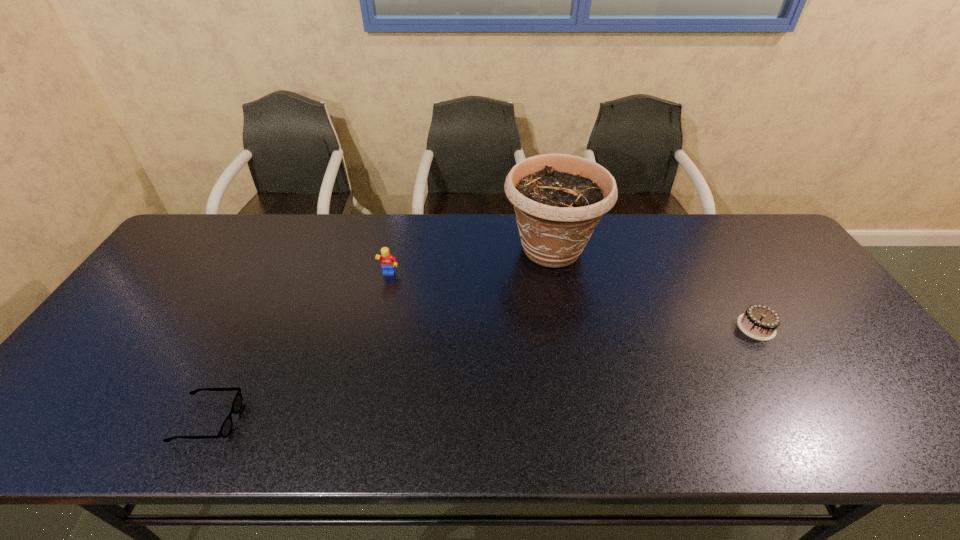
Identify the location of vacant space located on the back of the rightmost object. pos(703,238).

The height and width of the screenshot is (540, 960). I want to click on free space located on the arms of the shortest object, so click(273, 420).

Locate an element on the screen. This screenshot has height=540, width=960. object at the far edge is located at coordinates (558, 199).

Locate an element on the screen. The width and height of the screenshot is (960, 540). object located at the near edge is located at coordinates pyautogui.click(x=226, y=428).

What are the coordinates of `vacant space at the far edge` in the screenshot? It's located at (368, 244).

The width and height of the screenshot is (960, 540). In the image, there is a desktop. In order to click on vacant space at the near edge in this screenshot , I will do `click(312, 426)`.

Find the location of a particular element. Image resolution: width=960 pixels, height=540 pixels. free space at the left edge is located at coordinates (95, 367).

Find the location of a particular element. The height and width of the screenshot is (540, 960). vacant space at the near left corner of the desktop is located at coordinates (38, 424).

Find the location of `free space between the rightmost object and the second object from right to left`. free space between the rightmost object and the second object from right to left is located at coordinates (654, 288).

At what (x,y) coordinates should I click in order to perform the action: click on free area in between the flowerpot and the second tallest object. Please return your answer as a coordinate pair (x, y). Looking at the image, I should click on (470, 262).